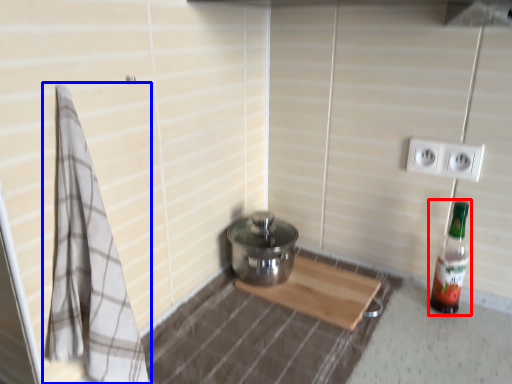
Question: Which object appears farthest to the camera in this image, bottle (highlighted by a red box) or bath towel (highlighted by a blue box)?

Choices:
 (A) bottle
 (B) bath towel

Answer: (A)